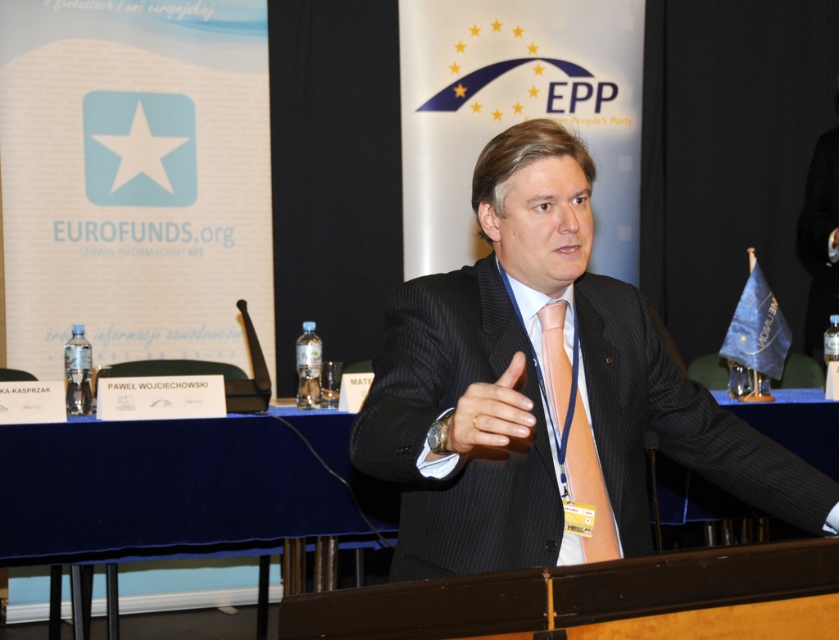
Question: Which object is the closest to the blue velvet table at center?

Choices:
 (A) pinstriped suit at center
 (B) dark gray suit at center
 (C) orange satin tie at center
 (D) blue fabric table at center

Answer: (D)

Question: Is blue fabric table at center further to camera compared to orange satin tie at center?

Choices:
 (A) no
 (B) yes

Answer: (B)

Question: Is the position of blue fabric table at center less distant than that of orange satin tie at center?

Choices:
 (A) no
 (B) yes

Answer: (A)

Question: Which of the following is the farthest from the observer?

Choices:
 (A) blue fabric table at center
 (B) pinstriped suit at center
 (C) blue velvet table at center

Answer: (A)

Question: Is dark gray suit at center smaller than pinstriped suit at center?

Choices:
 (A) yes
 (B) no

Answer: (B)

Question: Which point appears farthest from the camera in this image?

Choices:
 (A) (615, 532)
 (B) (772, 433)

Answer: (B)